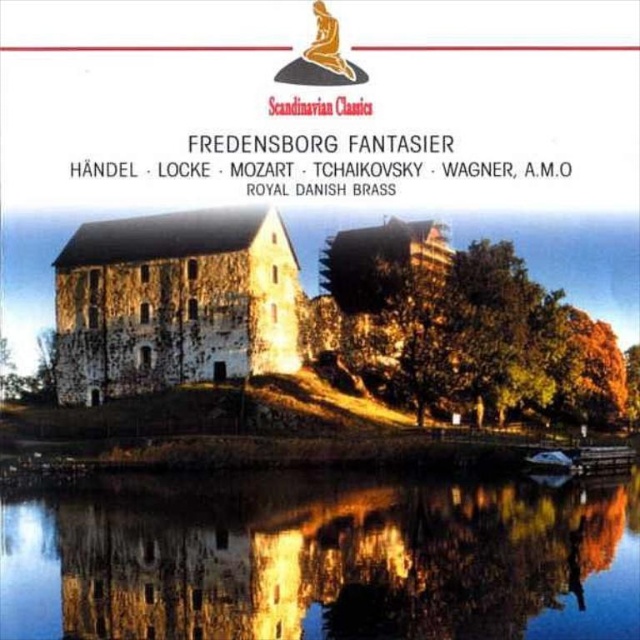
Question: In this image, where is transparent glass water at lower center located relative to stone textured castle at center?

Choices:
 (A) left
 (B) right

Answer: (B)

Question: Which object is farther from the camera taking this photo?

Choices:
 (A) stone textured castle at center
 (B) transparent glass water at lower center

Answer: (A)

Question: Can you confirm if transparent glass water at lower center is bigger than stone textured castle at center?

Choices:
 (A) no
 (B) yes

Answer: (A)

Question: Which point appears closest to the camera in this image?

Choices:
 (A) (353, 636)
 (B) (173, 344)

Answer: (A)

Question: Which point appears closest to the camera in this image?

Choices:
 (A) (205, 324)
 (B) (634, 632)

Answer: (B)

Question: Does transparent glass water at lower center appear under stone textured castle at center?

Choices:
 (A) yes
 (B) no

Answer: (A)